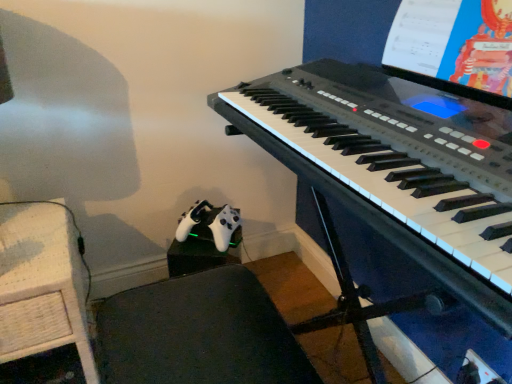
Question: Is white paper at upper right positioned behind black plastic keyboard at center?

Choices:
 (A) yes
 (B) no

Answer: (A)

Question: Is white paper at upper right located outside black plastic keyboard at center?

Choices:
 (A) no
 (B) yes

Answer: (B)

Question: Is black plastic keyboard at center a part of white paper at upper right?

Choices:
 (A) yes
 (B) no

Answer: (B)

Question: From the image's perspective, is white paper at upper right located above black plastic keyboard at center?

Choices:
 (A) yes
 (B) no

Answer: (A)

Question: Is white paper at upper right closer to the viewer compared to black plastic keyboard at center?

Choices:
 (A) no
 (B) yes

Answer: (A)

Question: Does white paper at upper right turn towards black plastic keyboard at center?

Choices:
 (A) no
 (B) yes

Answer: (B)

Question: Is woven wood table at lower left not inside white paper at upper right?

Choices:
 (A) no
 (B) yes

Answer: (B)

Question: Is woven wood table at lower left beside white paper at upper right?

Choices:
 (A) yes
 (B) no

Answer: (B)

Question: Is woven wood table at lower left looking in the opposite direction of white paper at upper right?

Choices:
 (A) yes
 (B) no

Answer: (B)

Question: Can you confirm if woven wood table at lower left is positioned to the left of white paper at upper right?

Choices:
 (A) no
 (B) yes

Answer: (B)

Question: From the image's perspective, would you say woven wood table at lower left is shown under white paper at upper right?

Choices:
 (A) yes
 (B) no

Answer: (A)

Question: From a real-world perspective, is woven wood table at lower left physically above white paper at upper right?

Choices:
 (A) no
 (B) yes

Answer: (A)

Question: From the image's perspective, does woven wood table at lower left appear higher than black plastic keyboard at center?

Choices:
 (A) no
 (B) yes

Answer: (A)